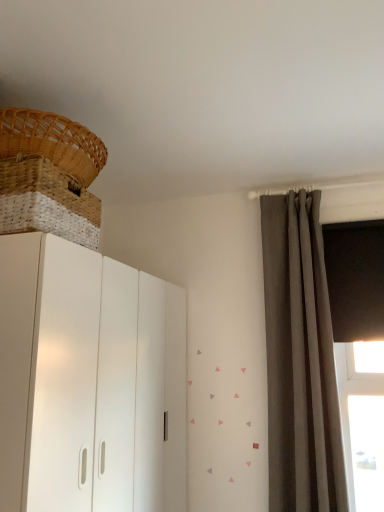
Question: Does matte gray curtain at right have a lesser width compared to woven wood basket at upper left, the 2th basket from the top?

Choices:
 (A) yes
 (B) no

Answer: (A)

Question: Is matte gray curtain at right at the left side of woven wood basket at upper left, the 2th basket from the top?

Choices:
 (A) yes
 (B) no

Answer: (B)

Question: Is matte gray curtain at right to the right of woven wood basket at upper left, the 2th basket from the top, from the viewer's perspective?

Choices:
 (A) yes
 (B) no

Answer: (A)

Question: Does matte gray curtain at right have a lesser height compared to woven wood basket at upper left, the 2th basket from the top?

Choices:
 (A) yes
 (B) no

Answer: (B)

Question: Is matte gray curtain at right smaller than woven wood basket at upper left, which is the first basket in bottom-to-top order?

Choices:
 (A) no
 (B) yes

Answer: (A)

Question: Considering their positions, is matte gray curtain at right located in front of or behind woven wood basket at upper left, the 2th basket from the top?

Choices:
 (A) front
 (B) behind

Answer: (B)

Question: Visually, is matte gray curtain at right positioned to the left or to the right of woven wood basket at upper left, the 2th basket from the top?

Choices:
 (A) left
 (B) right

Answer: (B)

Question: From the image's perspective, relative to woven wood basket at upper left, which is the first basket in bottom-to-top order, is matte gray curtain at right above or below?

Choices:
 (A) below
 (B) above

Answer: (A)

Question: Is matte gray curtain at right taller or shorter than woven wood basket at upper left, which is the first basket in bottom-to-top order?

Choices:
 (A) tall
 (B) short

Answer: (A)

Question: Considering the positions of point click(132, 323) and point click(76, 165), is point click(132, 323) closer or farther from the camera than point click(76, 165)?

Choices:
 (A) closer
 (B) farther

Answer: (B)

Question: From the image's perspective, is white matte cupboard at left positioned above or below woven wood basket at upper left, marked as the second basket in a bottom-to-top arrangement?

Choices:
 (A) below
 (B) above

Answer: (A)

Question: Considering the positions of white matte cupboard at left and woven wood basket at upper left, positioned as the 1th basket in top-to-bottom order, in the image, is white matte cupboard at left taller or shorter than woven wood basket at upper left, positioned as the 1th basket in top-to-bottom order,?

Choices:
 (A) short
 (B) tall

Answer: (B)

Question: In terms of size, does white matte cupboard at left appear bigger or smaller than woven wood basket at upper left, marked as the second basket in a bottom-to-top arrangement?

Choices:
 (A) big
 (B) small

Answer: (A)

Question: Considering the positions of woven wood basket at upper left, marked as the second basket in a bottom-to-top arrangement, and matte gray curtain at right in the image, is woven wood basket at upper left, marked as the second basket in a bottom-to-top arrangement, taller or shorter than matte gray curtain at right?

Choices:
 (A) tall
 (B) short

Answer: (B)

Question: Is point (97, 139) closer or farther from the camera than point (324, 473)?

Choices:
 (A) farther
 (B) closer

Answer: (B)